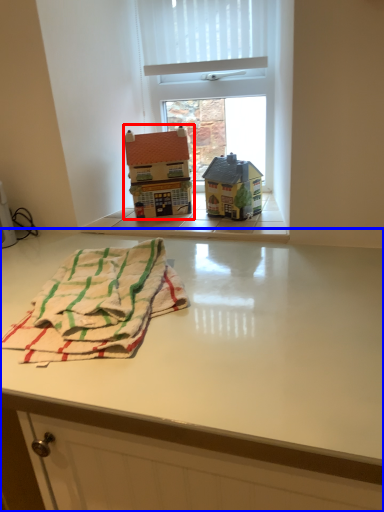
Question: Which of the following is the farthest to the observer, toy (highlighted by a red box) or table (highlighted by a blue box)?

Choices:
 (A) toy
 (B) table

Answer: (A)